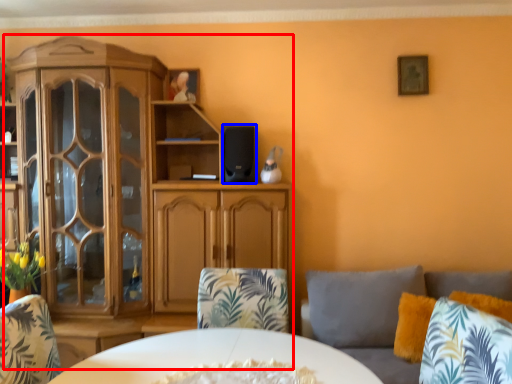
Question: Which of the following is the closest to the observer, cabinetry (highlighted by a red box) or speaker (highlighted by a blue box)?

Choices:
 (A) cabinetry
 (B) speaker

Answer: (A)